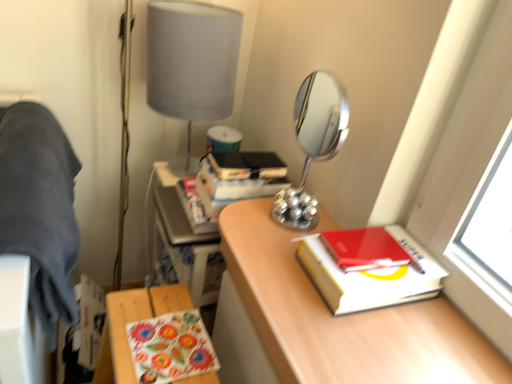
The width and height of the screenshot is (512, 384). Find the location of `red matte notebook at right`. red matte notebook at right is located at coordinates (364, 249).

What do you see at coordinates (183, 243) in the screenshot? I see `wooden desk at center` at bounding box center [183, 243].

This screenshot has width=512, height=384. What do you see at coordinates (40, 209) in the screenshot?
I see `dark blue fabric at left` at bounding box center [40, 209].

I want to click on floral fabric table at lower left, so click(132, 321).

Would you say wooden desk at center is part of red matte notebook at right's contents?

No, red matte notebook at right does not contain wooden desk at center.

Can you confirm if red matte notebook at right is shorter than wooden desk at center?

Yes.

Considering the positions of objects red matte notebook at right and wooden desk at center in the image provided, who is in front, red matte notebook at right or wooden desk at center?

red matte notebook at right is more forward.

Would you say wooden desk at center is inside or outside chrome/metallic mirror at center?

wooden desk at center is not enclosed by chrome/metallic mirror at center.

Is wooden desk at center touching chrome/metallic mirror at center?

No, wooden desk at center is not touching chrome/metallic mirror at center.

Between point (199, 297) and point (330, 153), which one is positioned in front?

Positioned in front is point (330, 153).

At what (x,y) coordinates should I click in order to perform the action: click on computer desk below the chrome/metallic mirror at center (from a real-world perspective). Please return your answer as a coordinate pair (x, y). Looking at the image, I should click on (183, 243).

Which is less distant, (115, 324) or (320, 257)?

Point (115, 324).

Are floral fabric table at lower left and hardcover book at right far apart?

No, floral fabric table at lower left is in close proximity to hardcover book at right.

Between floral fabric table at lower left and hardcover book at right, which one is positioned in front?

Positioned in front is hardcover book at right.

Between dark blue fabric at left and floral fabric table at lower left, which one is positioned in front?

dark blue fabric at left.

Is dark blue fabric at left oriented away from floral fabric table at lower left?

No, dark blue fabric at left is not facing away from floral fabric table at lower left.

From a real-world perspective, is dark blue fabric at left under floral fabric table at lower left?

No, from a real-world perspective, dark blue fabric at left is not below floral fabric table at lower left.

From the image's perspective, who appears lower, red matte notebook at right or dark blue fabric at left?

red matte notebook at right, from the image's perspective.

Which object is closer to the camera taking this photo, red matte notebook at right or dark blue fabric at left?

dark blue fabric at left is in front.

Does red matte notebook at right have a smaller size compared to dark blue fabric at left?

Yes.

Looking at this image, is chrome/metallic mirror at center bigger than red matte notebook at right?

Indeed, chrome/metallic mirror at center has a larger size compared to red matte notebook at right.

Looking at their sizes, would you say chrome/metallic mirror at center is wider or thinner than red matte notebook at right?

chrome/metallic mirror at center is thinner than red matte notebook at right.

Considering the positions of objects chrome/metallic mirror at center and red matte notebook at right in the image provided, who is more to the left, chrome/metallic mirror at center or red matte notebook at right?

From the viewer's perspective, chrome/metallic mirror at center appears more on the left side.

Does chrome/metallic mirror at center turn towards red matte notebook at right?

No, chrome/metallic mirror at center is not turned towards red matte notebook at right.

Is floral fabric table at lower left not within chrome/metallic mirror at center?

That's correct, floral fabric table at lower left is outside of chrome/metallic mirror at center.

This screenshot has width=512, height=384. I want to click on mirror that appears above the floral fabric table at lower left (from the image's perspective), so click(313, 143).

Would you say floral fabric table at lower left is a long distance from chrome/metallic mirror at center?

floral fabric table at lower left is near chrome/metallic mirror at center, not far away.

From a real-world perspective, is floral fabric table at lower left on top of chrome/metallic mirror at center?

Incorrect, from a real-world perspective, floral fabric table at lower left is lower than chrome/metallic mirror at center.

The width and height of the screenshot is (512, 384). What are the coordinates of `computer desk below the red matte notebook at right (from a real-world perspective)` in the screenshot? It's located at (183, 243).

The image size is (512, 384). I want to click on mirror above the wooden desk at center (from the image's perspective), so click(x=313, y=143).

Based on their spatial positions, is floral fabric table at lower left or dark blue fabric at left further from matte gray lampshade at upper center?

floral fabric table at lower left is positioned further to the anchor matte gray lampshade at upper center.

From the image, which object appears to be farther from hardcover book at right, wooden desk at center or red matte notebook at right?

wooden desk at center lies further to hardcover book at right than the other object.

Based on their spatial positions, is chrome/metallic mirror at center or wooden desk at center closer to matte gray lampshade at upper center?

Based on the image, chrome/metallic mirror at center appears to be nearer to matte gray lampshade at upper center.

Considering their positions, is matte gray lampshade at upper center positioned further to wooden desk at center than hardcover book at right?

hardcover book at right is further to wooden desk at center.

From the image, which object appears to be nearer to floral fabric table at lower left, chrome/metallic mirror at center or dark blue fabric at left?

dark blue fabric at left.

Which object lies further to the anchor point dark blue fabric at left, chrome/metallic mirror at center or red matte notebook at right?

red matte notebook at right lies further to dark blue fabric at left than the other object.

Looking at the image, which one is located closer to floral fabric table at lower left, wooden desk at center or matte gray lampshade at upper center?

Among the two, wooden desk at center is located nearer to floral fabric table at lower left.

Estimate the real-world distances between objects in this image. Which object is further from dark blue fabric at left, floral fabric table at lower left or wooden desk at center?

Among the two, wooden desk at center is located further to dark blue fabric at left.

Locate an element on the screen. The height and width of the screenshot is (384, 512). table located between dark blue fabric at left and hardcover book at right in the left-right direction is located at coordinates (132, 321).

Identify the location of mirror between floral fabric table at lower left and hardcover book at right from left to right. Image resolution: width=512 pixels, height=384 pixels. (313, 143).

Where is `table located between wooden desk at center and red matte notebook at right in the left-right direction`? This screenshot has height=384, width=512. table located between wooden desk at center and red matte notebook at right in the left-right direction is located at coordinates (132, 321).

Locate an element on the screen. The image size is (512, 384). mirror located between floral fabric table at lower left and red matte notebook at right in the left-right direction is located at coordinates (313, 143).